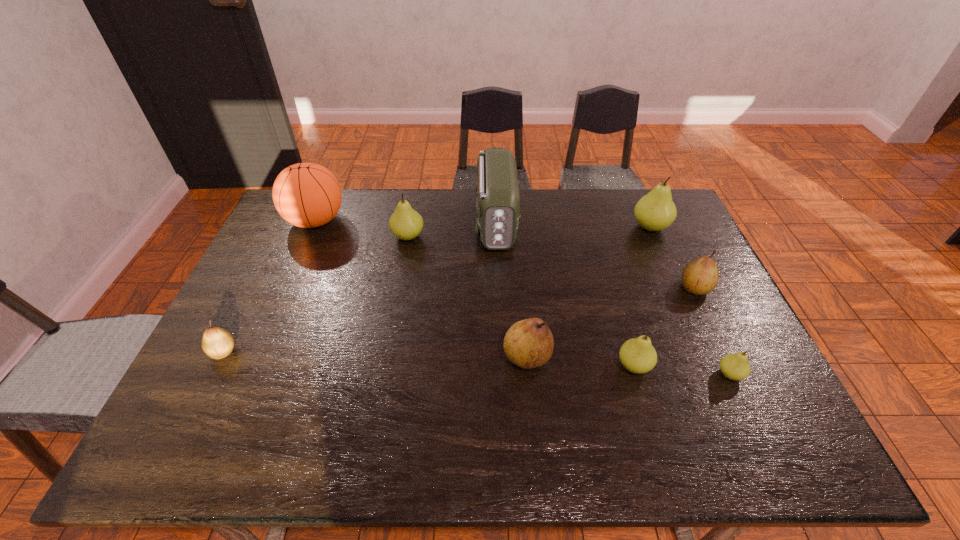
Identify the location of free space at the near edge. This screenshot has height=540, width=960. (494, 443).

In the image, there is a desktop. Where is `vacant space at the left edge`? This screenshot has height=540, width=960. vacant space at the left edge is located at coordinates (x=248, y=309).

The height and width of the screenshot is (540, 960). Find the location of `free space at the right edge of the desktop`. free space at the right edge of the desktop is located at coordinates (676, 251).

Locate an element on the screen. free space that is in between the smallest brown pear and the third pear from left to right is located at coordinates (375, 354).

Find the location of a particular element. free space between the basketball and the second biggest green pear is located at coordinates (362, 228).

Locate an element on the screen. The width and height of the screenshot is (960, 540). vacant area that lies between the basketball and the second brown pear from right to left is located at coordinates (421, 289).

Where is `free space that is in between the basketball and the fourth pear from left to right`? This screenshot has height=540, width=960. free space that is in between the basketball and the fourth pear from left to right is located at coordinates (475, 293).

The width and height of the screenshot is (960, 540). What are the coordinates of `vacant point located between the second smallest brown pear and the fourth pear from left to right` in the screenshot? It's located at (664, 327).

Image resolution: width=960 pixels, height=540 pixels. In order to click on unoccupied position between the third object from left to right and the basketball in this screenshot , I will do `click(362, 228)`.

Image resolution: width=960 pixels, height=540 pixels. Find the location of `vacant space in between the rightmost brown pear and the tallest pear`. vacant space in between the rightmost brown pear and the tallest pear is located at coordinates (672, 258).